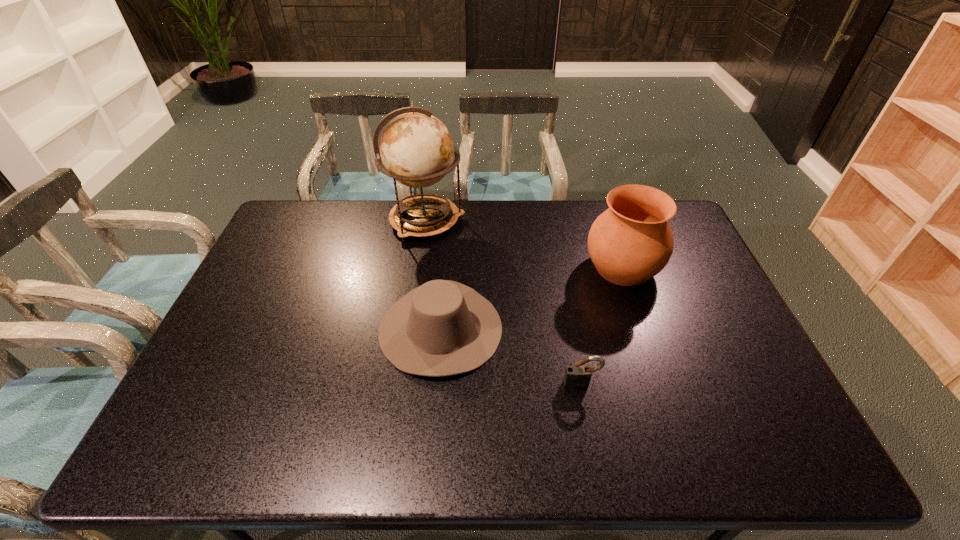
The height and width of the screenshot is (540, 960). I want to click on object that is at the right edge, so click(x=629, y=243).

Find the location of a particular element. This screenshot has height=540, width=960. free point at the far edge is located at coordinates (578, 221).

This screenshot has width=960, height=540. Find the location of `vacant space at the near edge of the desktop`. vacant space at the near edge of the desktop is located at coordinates (602, 455).

Locate an element on the screen. vacant space at the left edge of the desktop is located at coordinates (267, 347).

At what (x,y) coordinates should I click in order to perform the action: click on vacant region at the right edge of the desktop. Please return your answer as a coordinate pair (x, y). The height and width of the screenshot is (540, 960). Looking at the image, I should click on (788, 416).

In the image, there is a desktop. At what (x,y) coordinates should I click in order to perform the action: click on free region at the far left corner. Please return your answer as a coordinate pair (x, y). Looking at the image, I should click on (315, 221).

Locate an element on the screen. This screenshot has width=960, height=540. vacant space at the near right corner of the desktop is located at coordinates (783, 462).

The image size is (960, 540). Find the location of `vacant region between the second tallest object and the cowboy hat`. vacant region between the second tallest object and the cowboy hat is located at coordinates (532, 298).

Where is `free space between the globe and the rightmost object`? free space between the globe and the rightmost object is located at coordinates (524, 245).

Identify the location of vacant space that is in between the tallest object and the rightmost object. The width and height of the screenshot is (960, 540). (524, 245).